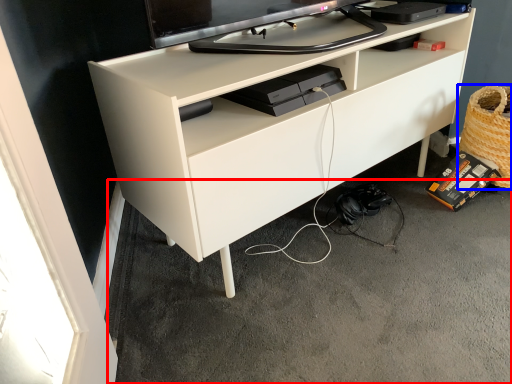
Question: Which of the following is the closest to the observer, concrete (highlighted by a red box) or basket (highlighted by a blue box)?

Choices:
 (A) concrete
 (B) basket

Answer: (A)